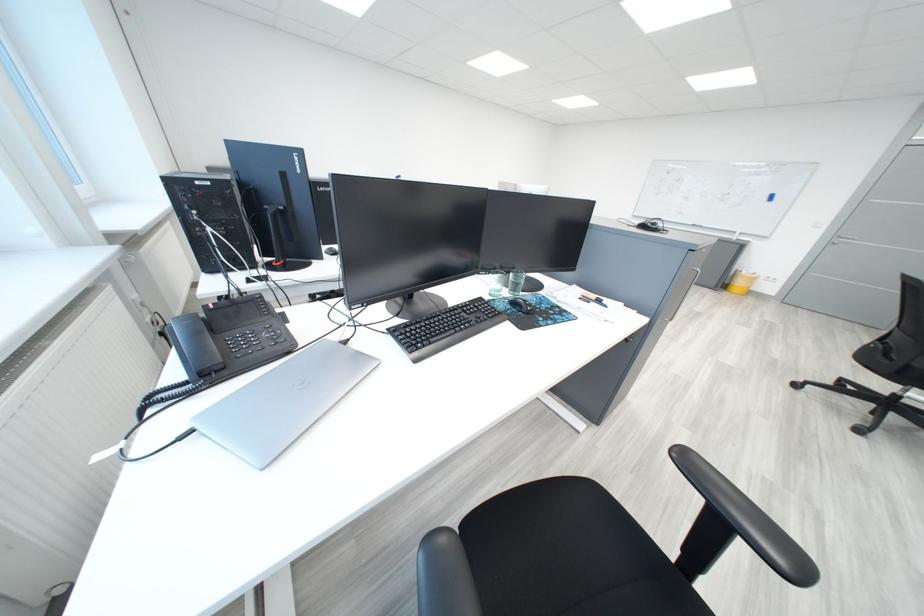
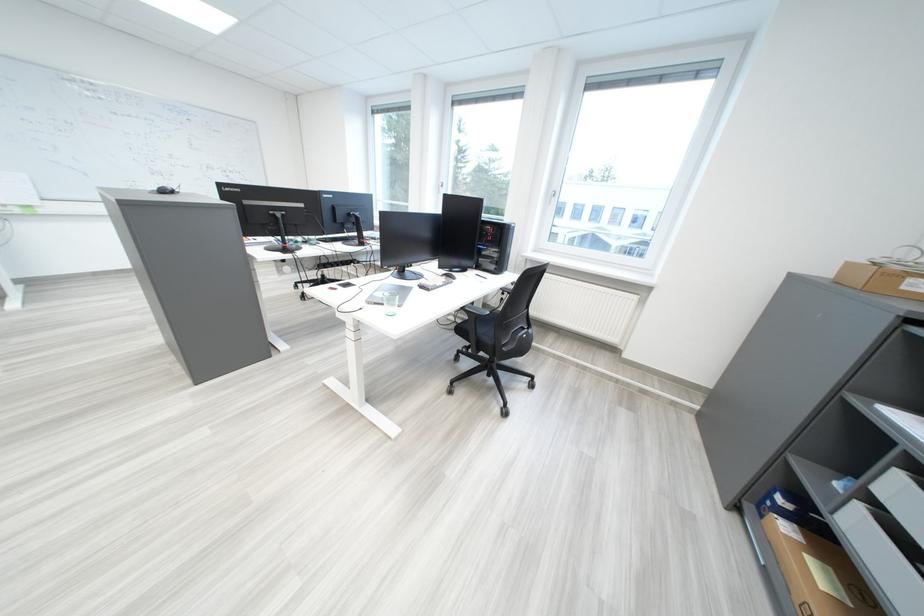
Question: I am providing you with two images of the same scene from different viewpoints. After the viewpoint changes to image2, which objects are now occluded?

Choices:
 (A) glass cup
 (B) white binder
 (C) white pedestal fan
 (D) black computer mouse

Answer: (A)